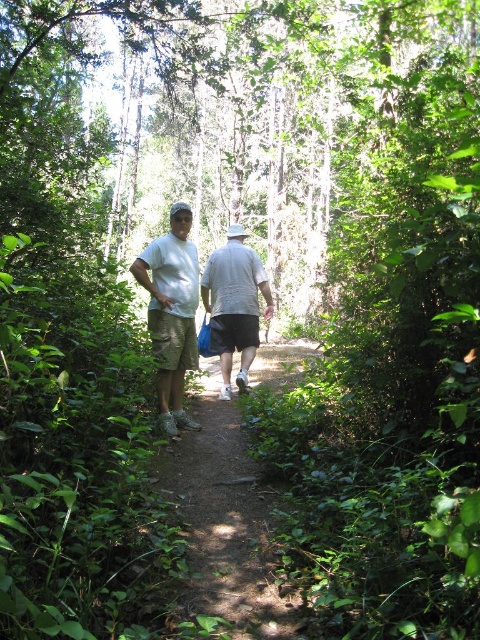
Consider the image. Can you confirm if light gray cotton shirt at center is shorter than gray cotton shirt at center?

Correct, light gray cotton shirt at center is not as tall as gray cotton shirt at center.

Which of these two, light gray cotton shirt at center or gray cotton shirt at center, stands shorter?

light gray cotton shirt at center is shorter.

What do you see at coordinates (171, 312) in the screenshot? I see `light gray cotton shirt at center` at bounding box center [171, 312].

At what (x,y) coordinates should I click in order to perform the action: click on light gray cotton shirt at center. Please return your answer as a coordinate pair (x, y). Looking at the image, I should click on (171, 312).

Who is more forward, (275, 618) or (181, 205)?

Point (275, 618)

Does point (197, 609) lie behind point (196, 364)?

No.

In order to click on dirt path at center in this screenshot , I will do `click(227, 522)`.

Is point (192, 449) closer to viewer compared to point (244, 234)?

Yes.

Can you confirm if dirt path at center is taller than gray cotton shirt at center?

No, dirt path at center is not taller than gray cotton shirt at center.

Who is more forward, (292, 360) or (252, 310)?

Point (252, 310) is in front.

The height and width of the screenshot is (640, 480). I want to click on dirt path at center, so click(227, 522).